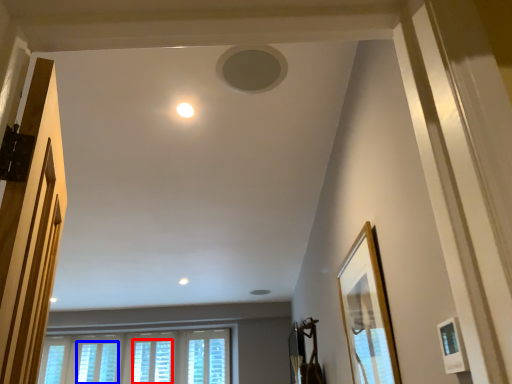
Question: Among these objects, which one is farthest to the camera, window (highlighted by a red box) or window (highlighted by a blue box)?

Choices:
 (A) window
 (B) window

Answer: (A)